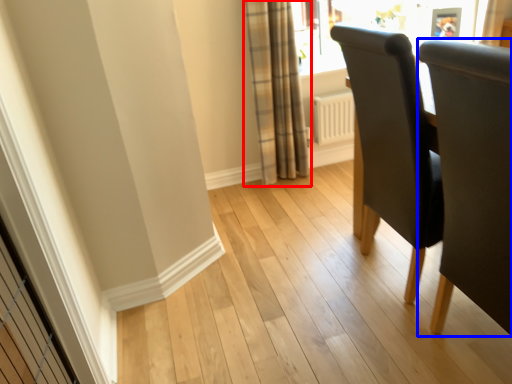
Question: Which object is closer to the camera taking this photo, curtain (highlighted by a red box) or chair (highlighted by a blue box)?

Choices:
 (A) curtain
 (B) chair

Answer: (B)